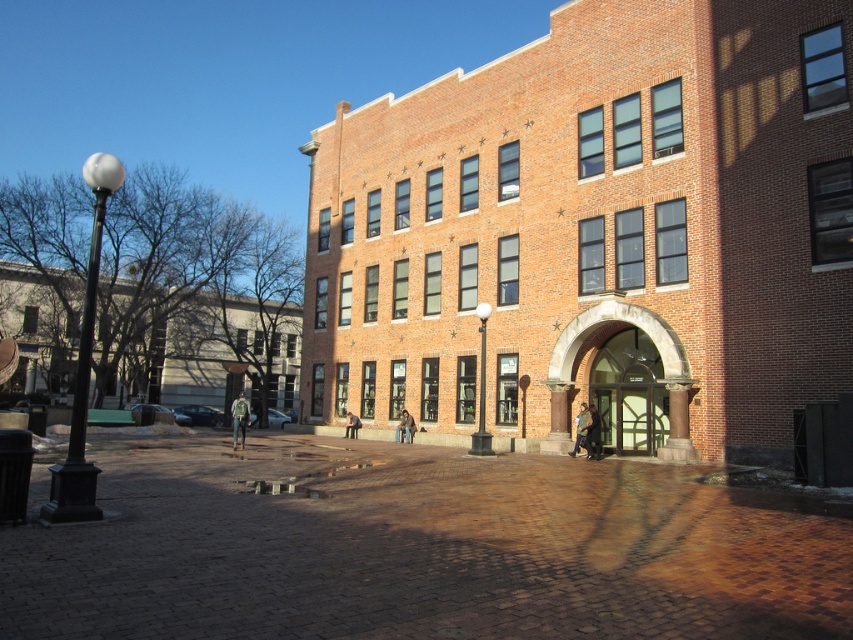
Question: Does brick archway at center have a greater width compared to clear glass door at center?

Choices:
 (A) no
 (B) yes

Answer: (A)

Question: Does brick archway at center come in front of clear glass door at center?

Choices:
 (A) yes
 (B) no

Answer: (A)

Question: Which object appears closest to the camera in this image?

Choices:
 (A) brick archway at center
 (B) clear glass door at center

Answer: (A)

Question: Among these points, which one is farthest from the camera?

Choices:
 (A) (x=553, y=401)
 (B) (x=646, y=365)

Answer: (A)

Question: Is brick archway at center below clear glass door at center?

Choices:
 (A) yes
 (B) no

Answer: (B)